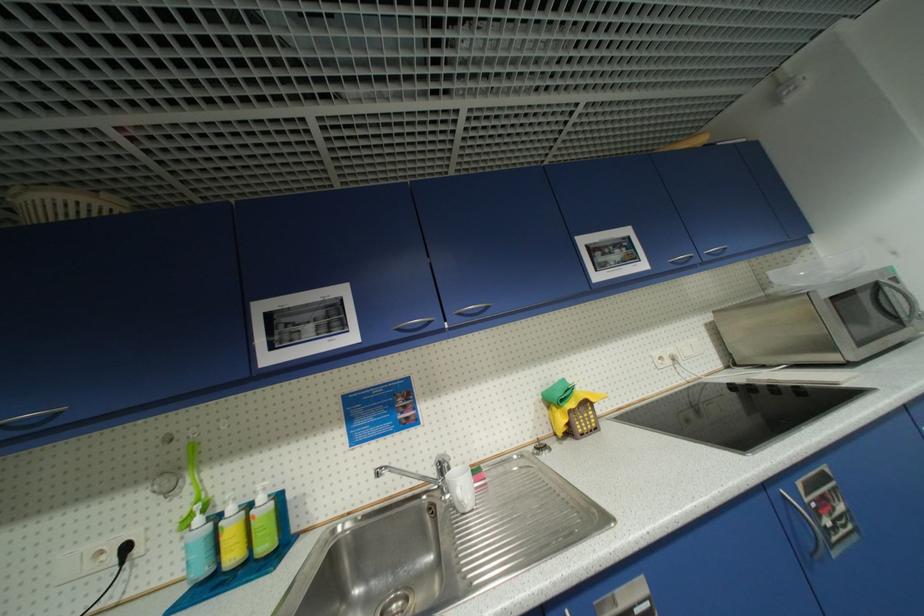
Describe the element at coordinates (229, 507) in the screenshot. This screenshot has height=616, width=924. I see `a yellow dispenser pump` at that location.